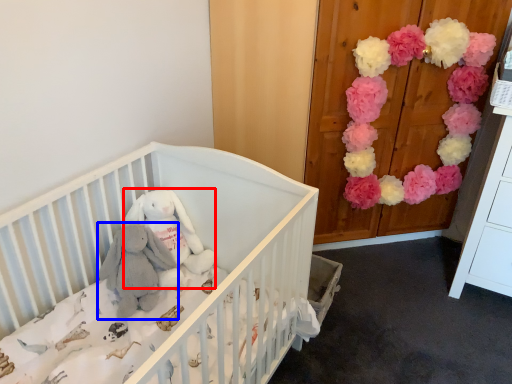
Question: Which object is further to the camera taking this photo, toy (highlighted by a red box) or baby elephant (highlighted by a blue box)?

Choices:
 (A) toy
 (B) baby elephant

Answer: (A)